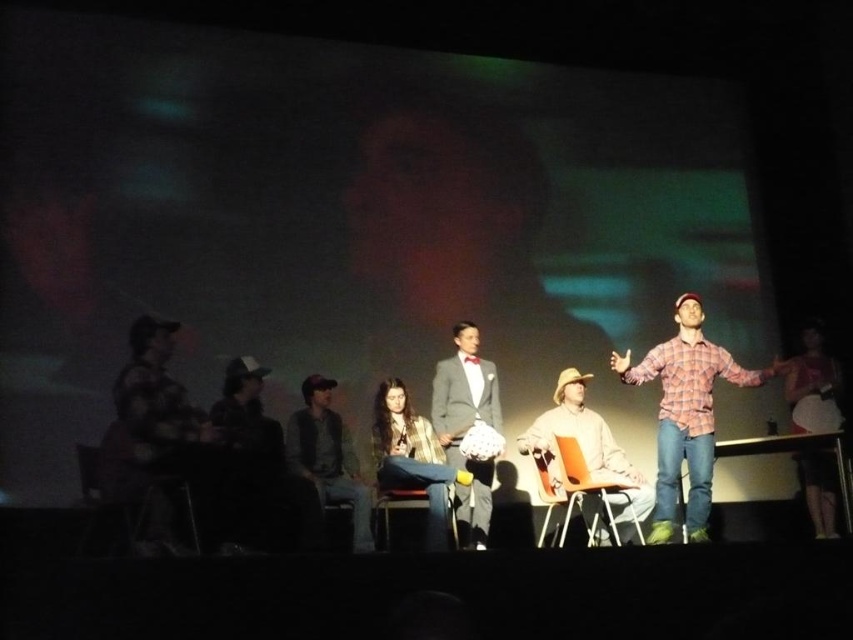
Question: Estimate the real-world distances between objects in this image. Which object is farther from the matte gray suit at center?

Choices:
 (A) metallic silver chair at lower left
 (B) gray wool sweater at center
 (C) plaid fabric shirt at right

Answer: (C)

Question: Which of these objects is positioned closest to the orange plastic chair at center?

Choices:
 (A) light brown leather hat at center
 (B) plaid flannel shirt at right

Answer: (A)

Question: Considering the real-world distances, which object is closest to the light brown leather hat at center?

Choices:
 (A) plaid flannel shirt at right
 (B) plaid fabric shirt at right
 (C) orange plastic chair at center
 (D) plaid fabric shirt at center

Answer: (C)

Question: Can you confirm if plaid flannel shirt at right is positioned above gray wool sweater at center?

Choices:
 (A) no
 (B) yes

Answer: (B)

Question: Is plaid flannel shirt at right further to camera compared to gray wool sweater at center?

Choices:
 (A) no
 (B) yes

Answer: (B)

Question: Is metallic silver chair at lower left smaller than plaid fabric shirt at center?

Choices:
 (A) yes
 (B) no

Answer: (A)